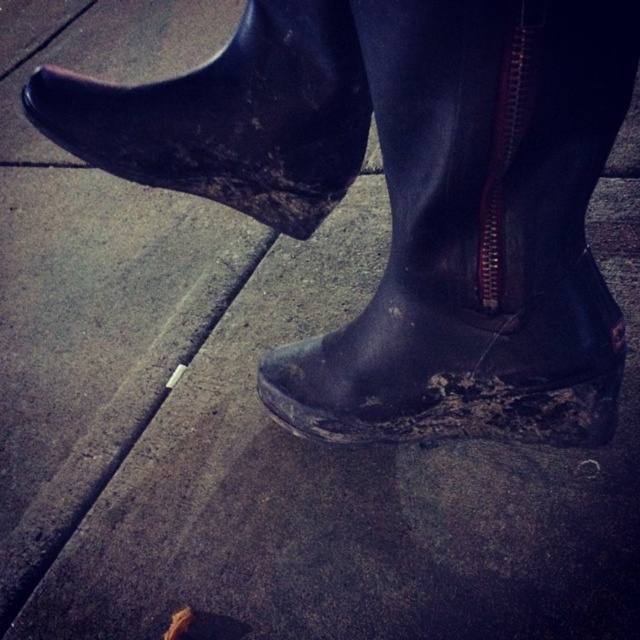
Consider the image. You are a photographer trying to capture the muddy rubber boot at center and the gray concrete curb at lower left in a single frame. Based on their positions, which object should you adjust your camera to focus on first to ensure both are in the frame?

The gray concrete curb at lower left should be focused on first since the muddy rubber boot at center is to the right of it, allowing you to adjust the frame to include both from left to right.

You are a photographer trying to capture the exact arrangement of the muddy rubber boots as shown in the image. If you move the muddy rubber boot at upper left to the right, where should the muddy rubber boot at center be positioned relative to the other boot to maintain the original spatial relationship?

The muddy rubber boot at center should be positioned below the muddy rubber boot at upper left to maintain the original spatial relationship.

Based on the photo, you are a delivery robot with a height of 24 inches. You need to navigate through the space between the muddy rubber boot at center and the gray concrete curb at lower left. Can you pass through this space without hitting your head?

The distance between the muddy rubber boot at center and the gray concrete curb at lower left is 18.36 inches. Since the robot is 24 inches tall, it cannot pass through this space without hitting its head as the height is insufficient.